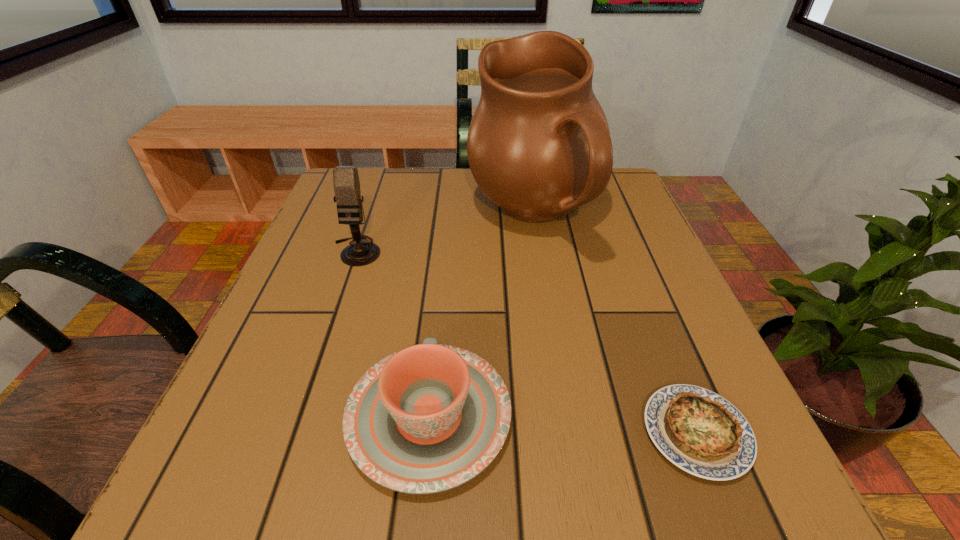
Image resolution: width=960 pixels, height=540 pixels. I want to click on blank region between the second shortest object and the leftmost object, so click(393, 334).

In order to click on empty space that is in between the third tallest object and the shortest object in this screenshot , I will do `click(563, 424)`.

The image size is (960, 540). I want to click on vacant point located between the chinaware and the shortest object, so click(563, 424).

This screenshot has height=540, width=960. Find the location of `vacant area that lies between the chinaware and the tallest object`. vacant area that lies between the chinaware and the tallest object is located at coordinates (482, 316).

Locate an element on the screen. Image resolution: width=960 pixels, height=540 pixels. vacant point located between the tallest object and the third tallest object is located at coordinates (482, 316).

You are a GUI agent. You are given a task and a screenshot of the screen. Output one action in this format:
    pyautogui.click(x=<x>, y=<y>)
    Task: Click on the free point between the third tallest object and the quiche
    
    Given the screenshot: What is the action you would take?
    pyautogui.click(x=563, y=424)

Where is `the closest object to the microphone`? This screenshot has height=540, width=960. the closest object to the microphone is located at coordinates (538, 146).

At what (x,y) coordinates should I click in order to perform the action: click on the closest object relative to the shortest object. Please return your answer as a coordinate pair (x, y). The image size is (960, 540). Looking at the image, I should click on coord(426,419).

Identify the location of free region that satisfies the following two spatial constraints: 1. at the spout of the cream pitcher; 2. on the front-facing side of the microphone. This screenshot has width=960, height=540. (540, 251).

Find the location of a particular element. This screenshot has height=540, width=960. blank space that satisfies the following two spatial constraints: 1. on the front-facing side of the second tallest object; 2. on the right side of the quiche is located at coordinates (294, 433).